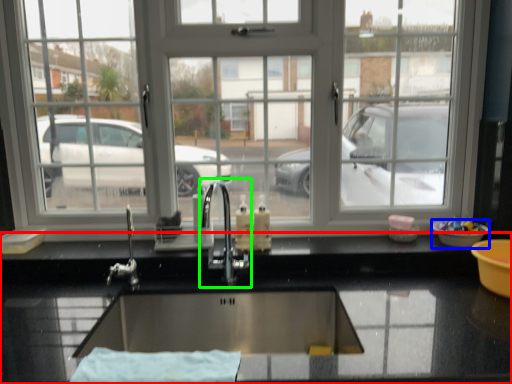
Question: Based on their relative distances, which object is nearer to countertop (highlighted by a red box)? Choose from basin (highlighted by a blue box) and tap (highlighted by a green box).

Choices:
 (A) basin
 (B) tap

Answer: (B)